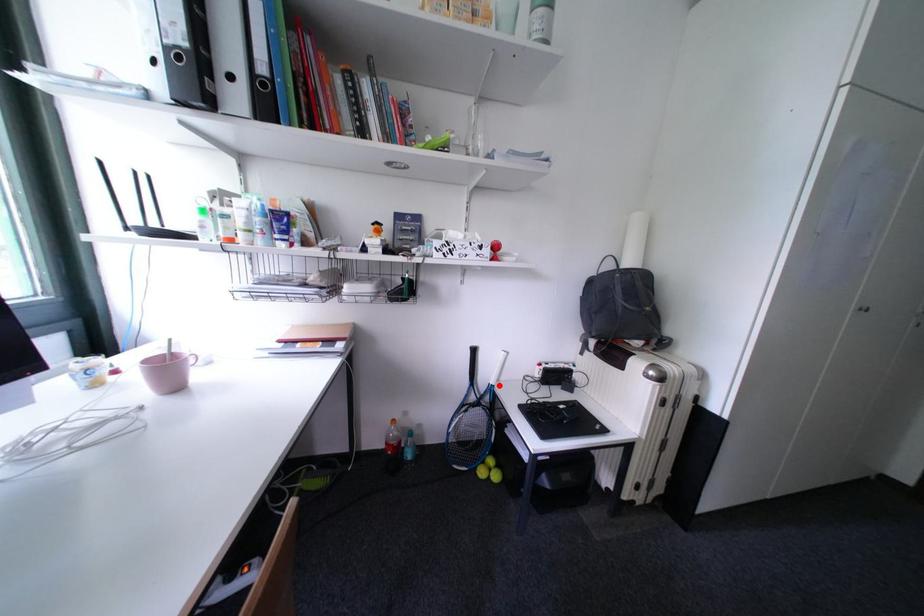
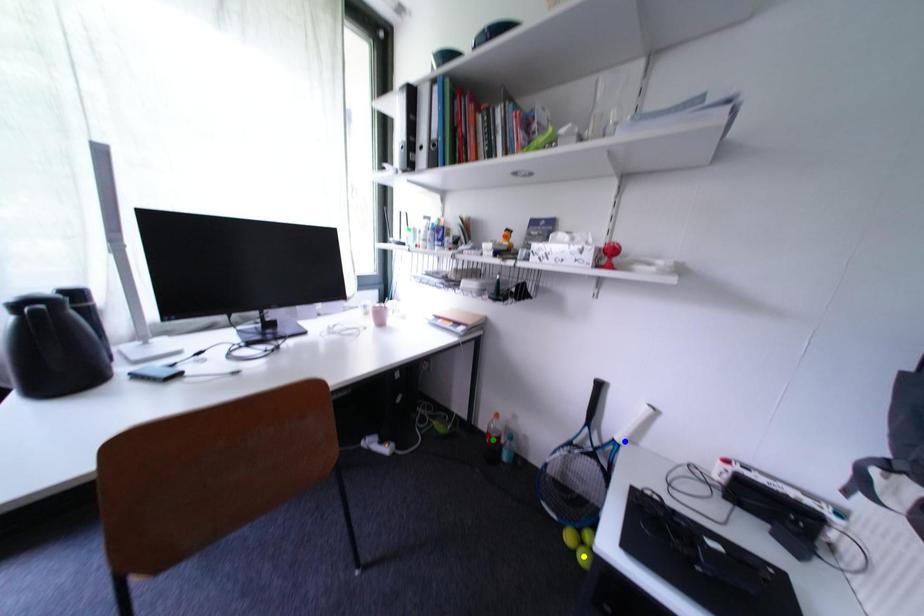
Question: I am providing you with two images of the same scene from different viewpoints. A red point is marked on the first image. You are given multiple points on the second image. Can you choose the point in image 2 that corresponds to the point in image 1?

Choices:
 (A) green point
 (B) yellow point
 (C) blue point

Answer: (C)